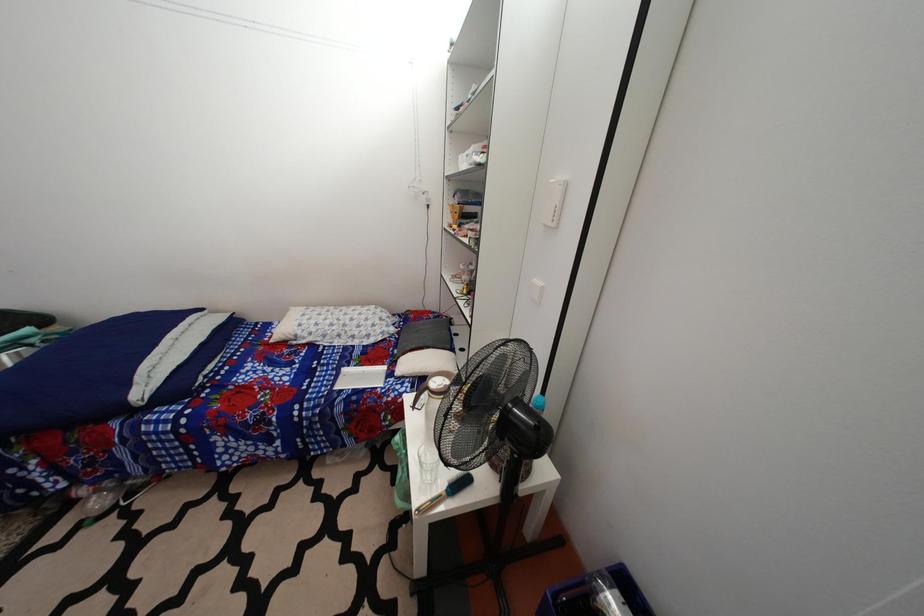
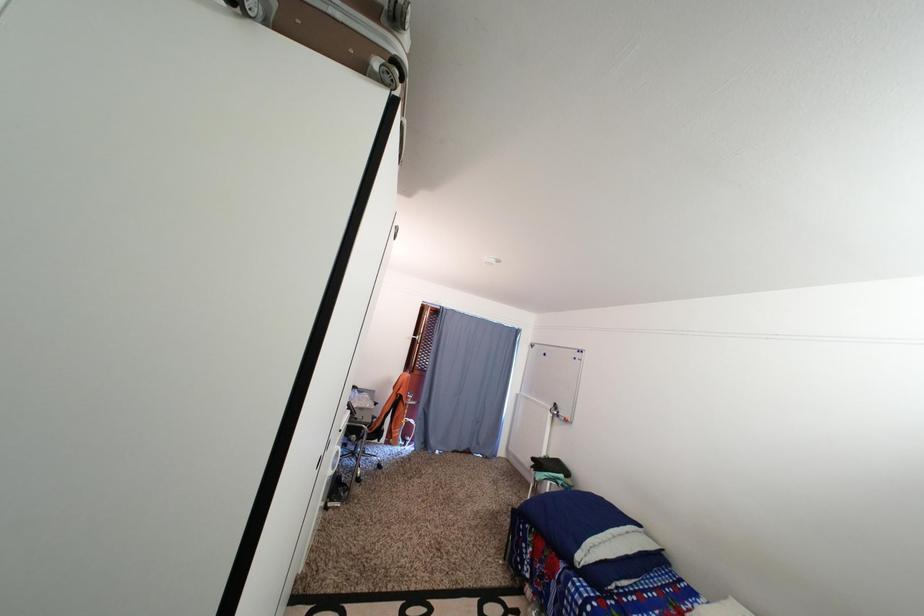
Question: Based on the continuous images, in which direction is the camera rotating? Reply with the corresponding letter.

Choices:
 (A) Left
 (B) Right
 (C) Up
 (D) Down

Answer: (A)